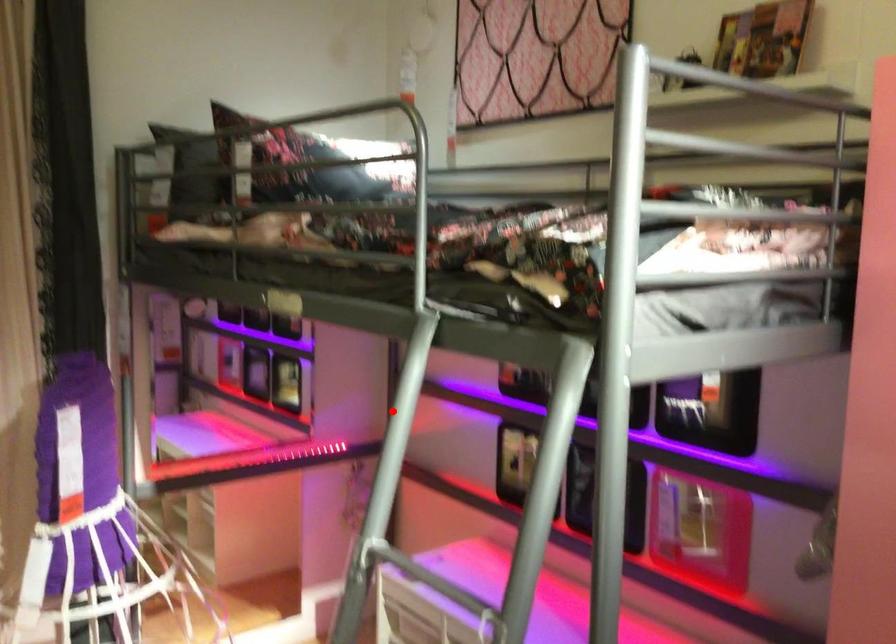
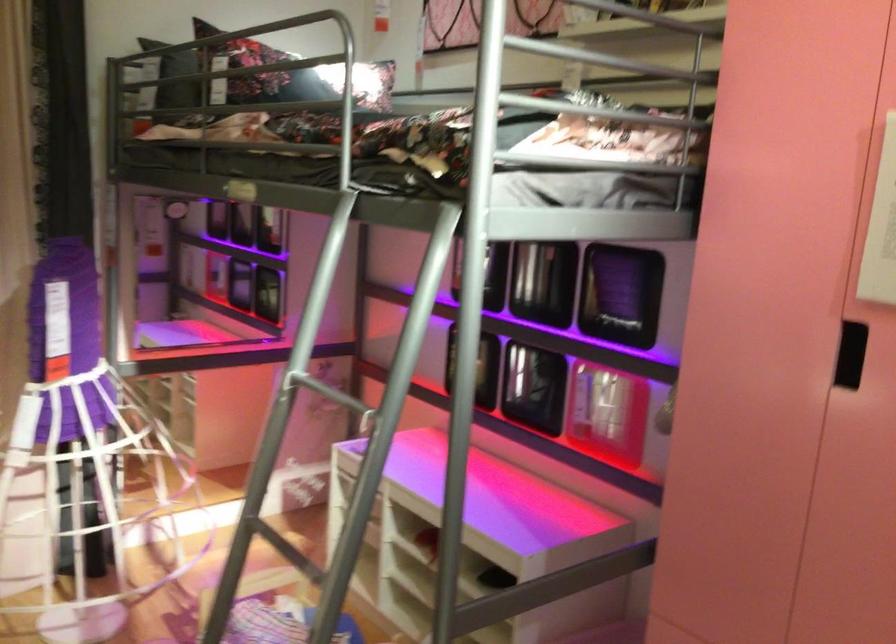
Where in the second image is the point corresponding to the highlighted location from the first image?

(316, 270)